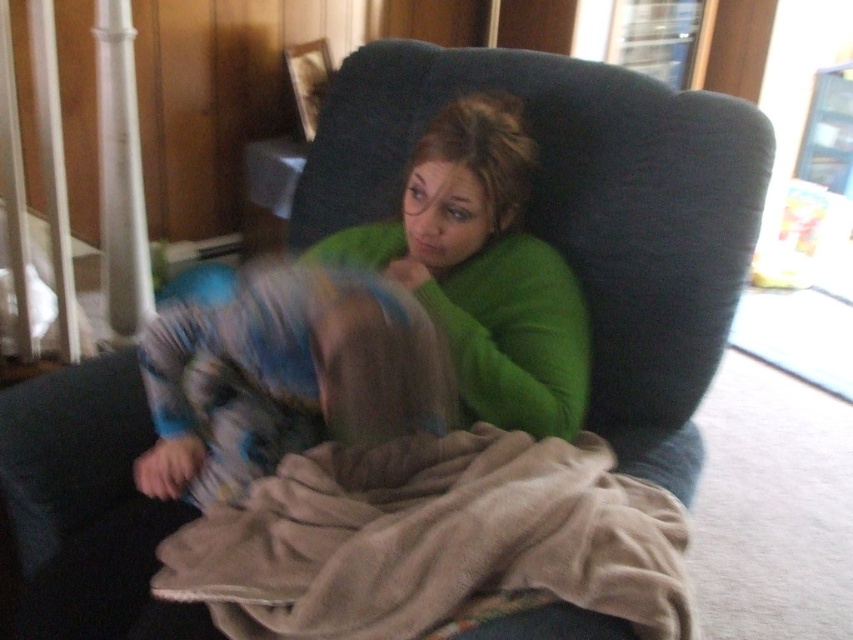
You are a photographer taking a picture of the beige soft blanket at center and the green soft sweater at center. Which object is located to the right of the other?

The beige soft blanket at center is positioned on the right side of green soft sweater at center.

You are a photographer trying to capture a candid shot of the two subjects in the scene. You notice the green soft sweater at center and the blue and white fabric at center. Which object should you focus on if you want to capture the subject on the right side of the frame?

The green soft sweater at center is to the right of blue and white fabric at center, so focusing on the green soft sweater at center will capture the subject on the right side of the frame.

You are a photographer setting up for a family photo. You see the beige soft blanket at center and the blue and white fabric at center in the scene. Which object should you adjust to ensure both items are fully visible in the frame?

The beige soft blanket at center is smaller than the blue and white fabric at center. To ensure both items are fully visible, adjust the blue and white fabric at center since it is larger and might be spilling out of the frame.